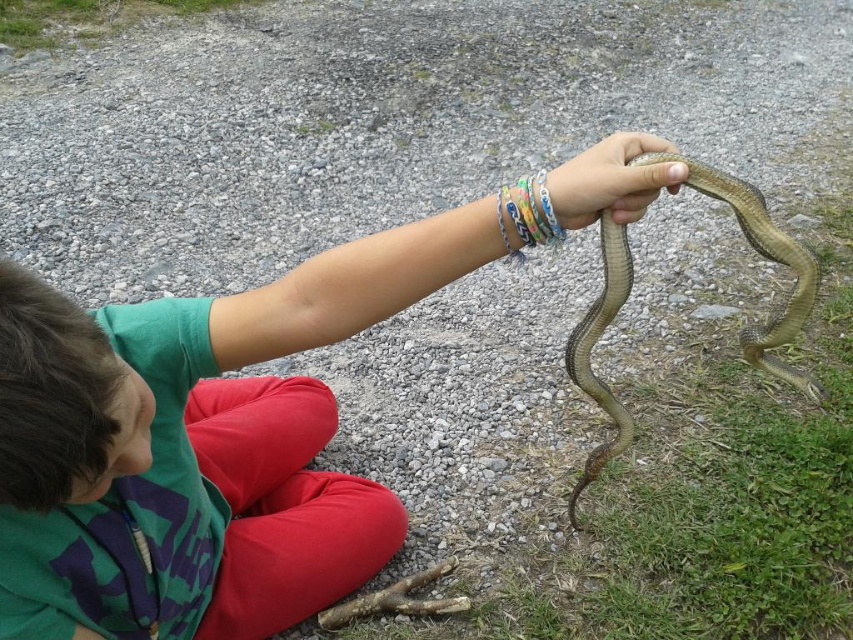
You are a fashion designer observing the outdoor scene. You need to create a design that incorporates both the green matte shirt at upper center and the multicolored plastic bracelets at center. Which object should you use as the main focal point if you want the larger element to dominate the design?

The green matte shirt at upper center should be the main focal point because its width surpasses the multicolored plastic bracelets at center, making it the larger element.

You are standing at the origin of a coordinate system placed at the bottom left corner of the image. The person is located at position 0.5, 0.5. Can you determine if the point at (766, 259) is closer to the person or to the snake?

The point at (766, 259) corresponds to the green scaly snake at right. Since the person is at 0.5, 0.5, the distance between the person and the point is sqrt of squared differences. The distance to the snake is zero since the point is exactly where the snake is. Therefore, the point is closer to the snake.

You are a photographer trying to capture the interaction between the person and the snake. You need to position your camera so that the green matte shirt at upper center and the smooth skin hand at center are both visible. Based on their positions, which object should be placed closer to the left side of the frame?

The green matte shirt at upper center should be placed closer to the left side of the frame because it is to the left of the smooth skin hand at center.